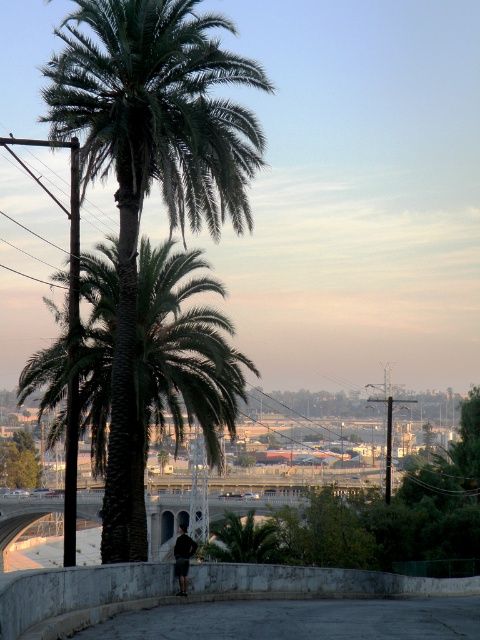
Question: Is green leafy palm tree at center behind dark gray fabric pants at center?

Choices:
 (A) yes
 (B) no

Answer: (B)

Question: Which of the following is the farthest from the observer?

Choices:
 (A) dark gray fabric pants at center
 (B) green leafy palm tree at center
 (C) concrete ledge at lower center

Answer: (A)

Question: Among these objects, which one is farthest from the camera?

Choices:
 (A) dark gray fabric pants at center
 (B) concrete ledge at lower center
 (C) green leafy palm tree at center

Answer: (A)

Question: Among these objects, which one is farthest from the camera?

Choices:
 (A) dark gray fabric pants at center
 (B) green leafy palm tree at center
 (C) concrete ledge at lower center

Answer: (A)

Question: Is green leafy palm tree at center in front of concrete ledge at lower center?

Choices:
 (A) yes
 (B) no

Answer: (B)

Question: Does green leafy palm tree at center come behind concrete ledge at lower center?

Choices:
 (A) no
 (B) yes

Answer: (B)